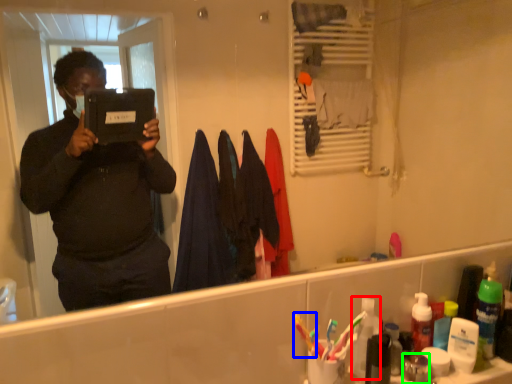
Question: Which object is positioned farthest from toiletry (highlighted by a red box)? Select from toothbrush (highlighted by a blue box) and toiletry (highlighted by a green box).

Choices:
 (A) toothbrush
 (B) toiletry

Answer: (B)